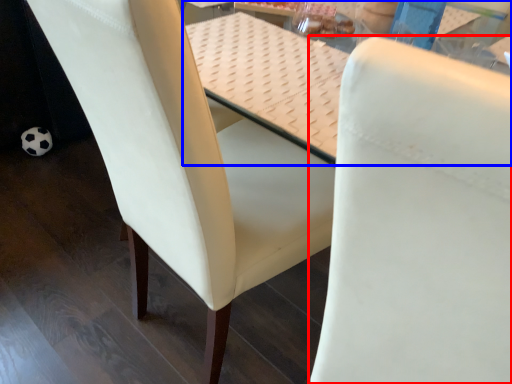
Question: Which of the following is the closest to the observer, chair (highlighted by a red box) or table (highlighted by a blue box)?

Choices:
 (A) chair
 (B) table

Answer: (A)